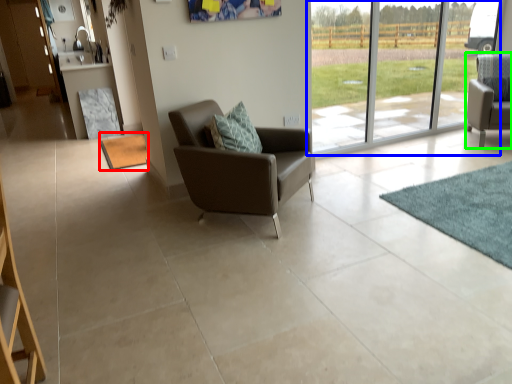
Question: Estimate the real-world distances between objects in this image. Which object is closer to mat (highlighted by a red box), window (highlighted by a blue box) or chair (highlighted by a green box)?

Choices:
 (A) window
 (B) chair

Answer: (A)